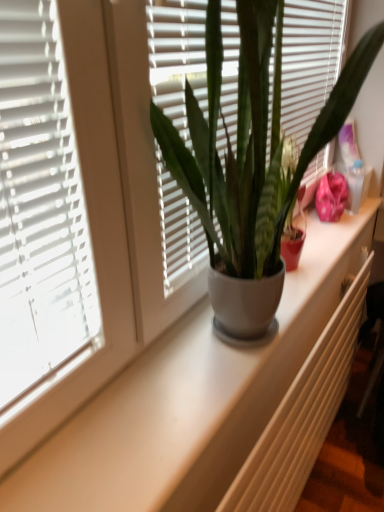
Question: Does white textured radiator at center have a smaller size compared to matte gray pot at center?

Choices:
 (A) no
 (B) yes

Answer: (B)

Question: Considering the relative positions of white textured radiator at center and matte gray pot at center in the image provided, is white textured radiator at center to the left of matte gray pot at center from the viewer's perspective?

Choices:
 (A) yes
 (B) no

Answer: (B)

Question: Is white textured radiator at center facing towards matte gray pot at center?

Choices:
 (A) no
 (B) yes

Answer: (A)

Question: Is white textured radiator at center taller than matte gray pot at center?

Choices:
 (A) yes
 (B) no

Answer: (B)

Question: Is white textured radiator at center located outside matte gray pot at center?

Choices:
 (A) no
 (B) yes

Answer: (B)

Question: Could matte gray pot at center be considered to be inside white textured radiator at center?

Choices:
 (A) no
 (B) yes

Answer: (A)

Question: Is matte gray pot at center taller than white textured radiator at center?

Choices:
 (A) yes
 (B) no

Answer: (A)

Question: From the image's perspective, does matte gray pot at center appear higher than white textured radiator at center?

Choices:
 (A) no
 (B) yes

Answer: (B)

Question: Is matte gray pot at center wider than white textured radiator at center?

Choices:
 (A) no
 (B) yes

Answer: (B)

Question: From a real-world perspective, is matte gray pot at center physically below white textured radiator at center?

Choices:
 (A) yes
 (B) no

Answer: (B)

Question: Can you see matte gray pot at center touching white textured radiator at center?

Choices:
 (A) yes
 (B) no

Answer: (B)

Question: Is matte gray pot at center thinner than white textured radiator at center?

Choices:
 (A) yes
 (B) no

Answer: (B)

Question: Considering the relative positions of matte gray pot at center and white textured radiator at center in the image provided, is matte gray pot at center to the left or to the right of white textured radiator at center?

Choices:
 (A) right
 (B) left

Answer: (B)